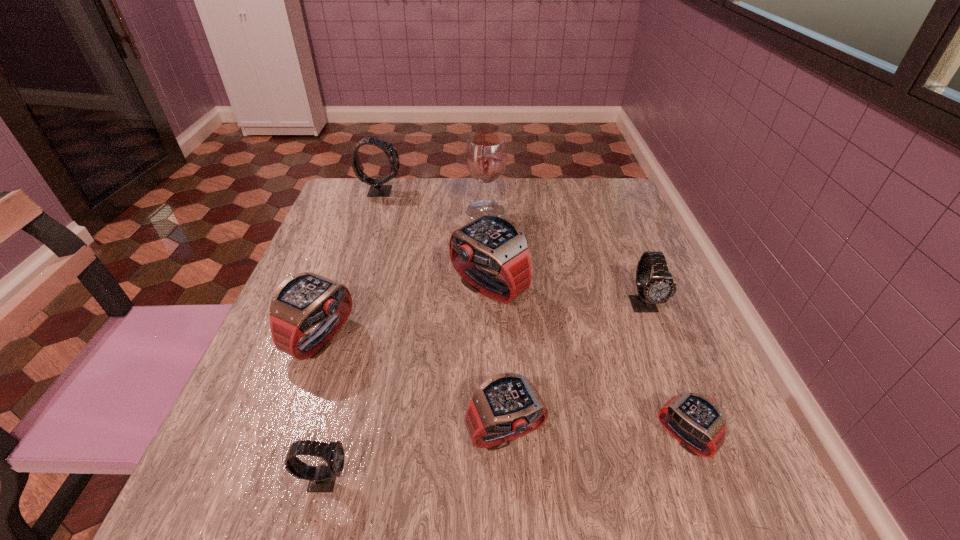
The image size is (960, 540). I want to click on wineglass situated at the far edge, so click(x=486, y=155).

This screenshot has height=540, width=960. Find the location of `watch present at the far edge`. watch present at the far edge is located at coordinates (377, 189).

Identify the location of object that is at the far left corner. The height and width of the screenshot is (540, 960). (377, 189).

The image size is (960, 540). I want to click on object that is at the near left corner, so click(322, 478).

Find the location of a particular element. Image resolution: width=960 pixels, height=540 pixels. object that is at the near right corner is located at coordinates (695, 421).

The height and width of the screenshot is (540, 960). In order to click on vacant space at the far edge of the desktop in this screenshot , I will do `click(450, 193)`.

This screenshot has height=540, width=960. Identify the location of free space at the near edge. (618, 507).

Where is `vacant space at the left edge`? The height and width of the screenshot is (540, 960). vacant space at the left edge is located at coordinates (276, 359).

In the image, there is a desktop. Identify the location of vacant region at the right edge. Image resolution: width=960 pixels, height=540 pixels. (639, 239).

Where is `free region at the far left corner of the desktop`? free region at the far left corner of the desktop is located at coordinates (383, 202).